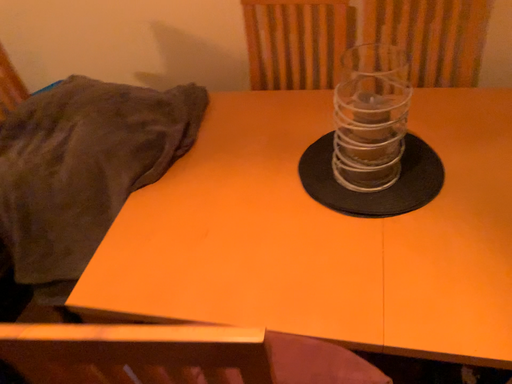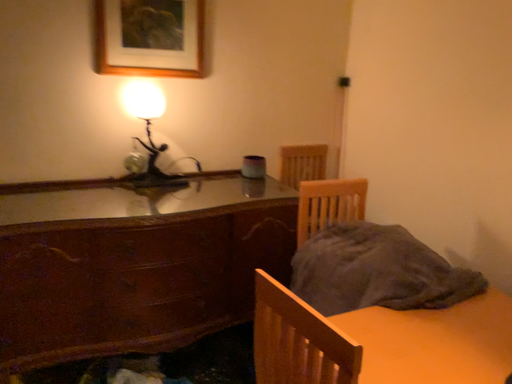
Question: Which way did the camera rotate in the video?

Choices:
 (A) rotated downward
 (B) rotated upward

Answer: (B)